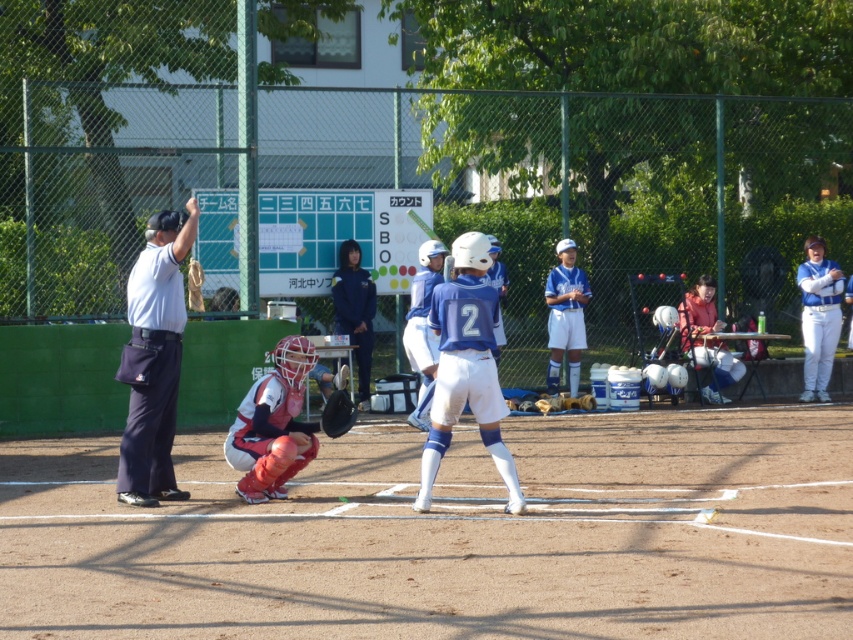
You are a photographer standing at the edge of the baseball field. You want to take a photo that includes both point (451, 333) and point (582, 288). Which point will appear larger in the photo?

Point (451, 333) will appear larger in the photo because it is closer to the camera than point (582, 288).

You are a spectator at the baseball game and want to take a photo of both the blue uniform at center and the matte red catcher at center. Which one should you focus on first to ensure both are in the frame?

The blue uniform at center is positioned on the right side of matte red catcher at center, so you should focus on the matte red catcher at center first to ensure both are in the frame.